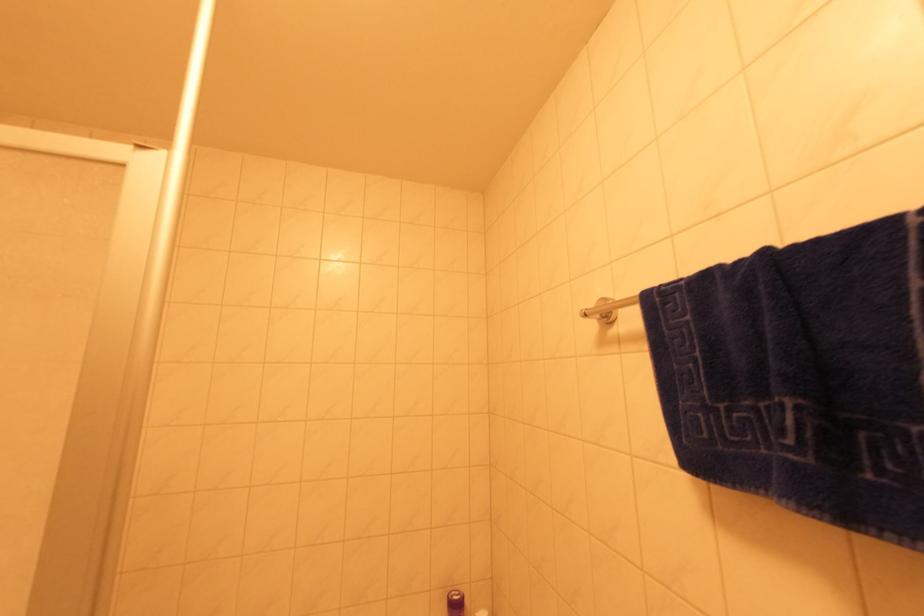
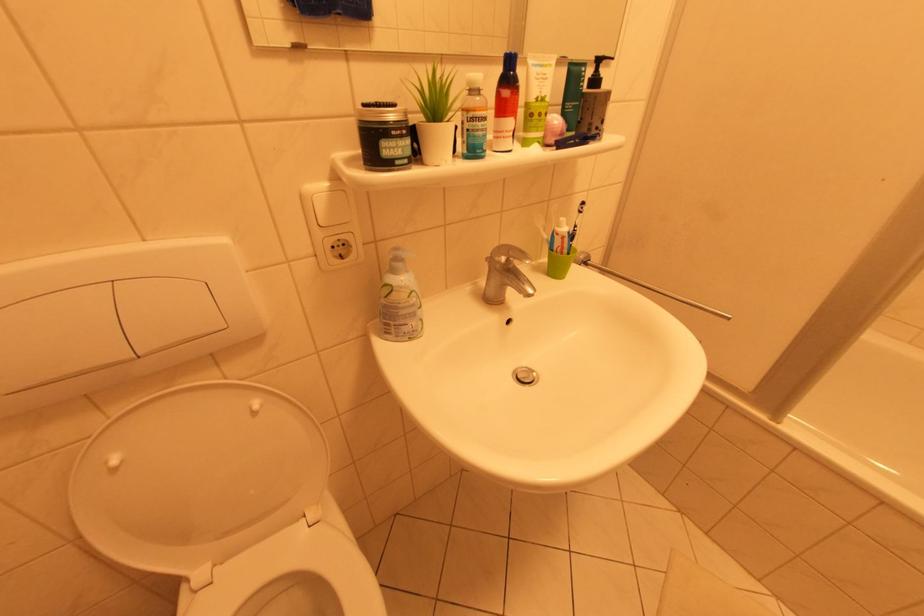
The images are taken continuously from a first-person perspective. In which direction is your viewpoint rotating?

The camera's rotation is toward left-down.